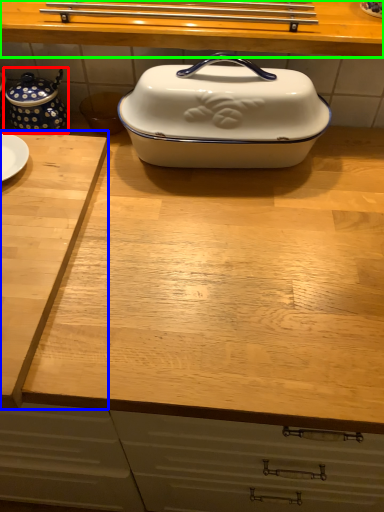
Question: Considering the real-world distances, which object is farthest from tea pot (highlighted by a red box)? cutting board (highlighted by a blue box) or countertop (highlighted by a green box)?

Choices:
 (A) cutting board
 (B) countertop

Answer: (B)